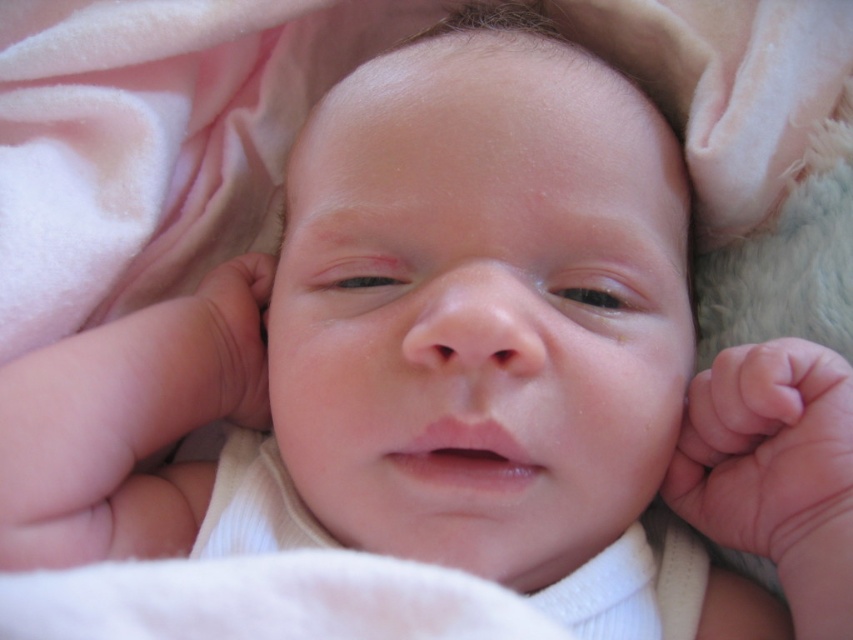
Does pink soft skin at lower right have a greater width compared to pink soft skin at left?

Correct, the width of pink soft skin at lower right exceeds that of pink soft skin at left.

Does pink soft skin at lower right have a lesser width compared to pink soft skin at left?

No.

The height and width of the screenshot is (640, 853). I want to click on pink soft skin at lower right, so click(x=770, y=458).

Find the location of `pink soft skin at lower right`. pink soft skin at lower right is located at coordinates (770, 458).